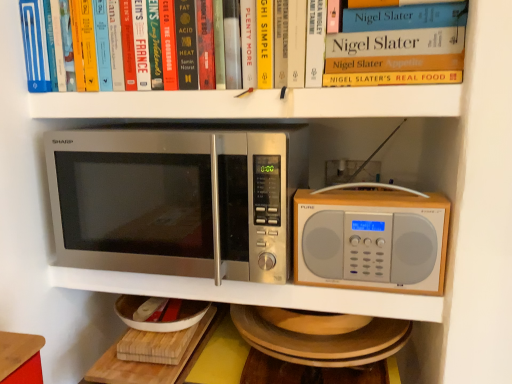
Question: Considering the positions of hardcover book at upper center and wooden cutting board at lower center in the image, is hardcover book at upper center taller or shorter than wooden cutting board at lower center?

Choices:
 (A) short
 (B) tall

Answer: (B)

Question: From the image's perspective, is hardcover book at upper center located above or below wooden cutting board at lower center?

Choices:
 (A) below
 (B) above

Answer: (B)

Question: Which of these objects is positioned closest to the hardcover book at upper center?

Choices:
 (A) wooden cutting board at lower center
 (B) silver metallic microwave at center, which is counted as the first microwave oven, starting from the right
 (C) stainless steel microwave at left, marked as the 1th microwave oven in a left-to-right arrangement

Answer: (C)

Question: Based on their relative distances, which object is farther from the wooden cutting board at lower center?

Choices:
 (A) hardcover book at upper center
 (B) stainless steel microwave at left, placed as the second microwave oven when sorted from right to left
 (C) silver metallic microwave at center, which is counted as the first microwave oven, starting from the right

Answer: (A)